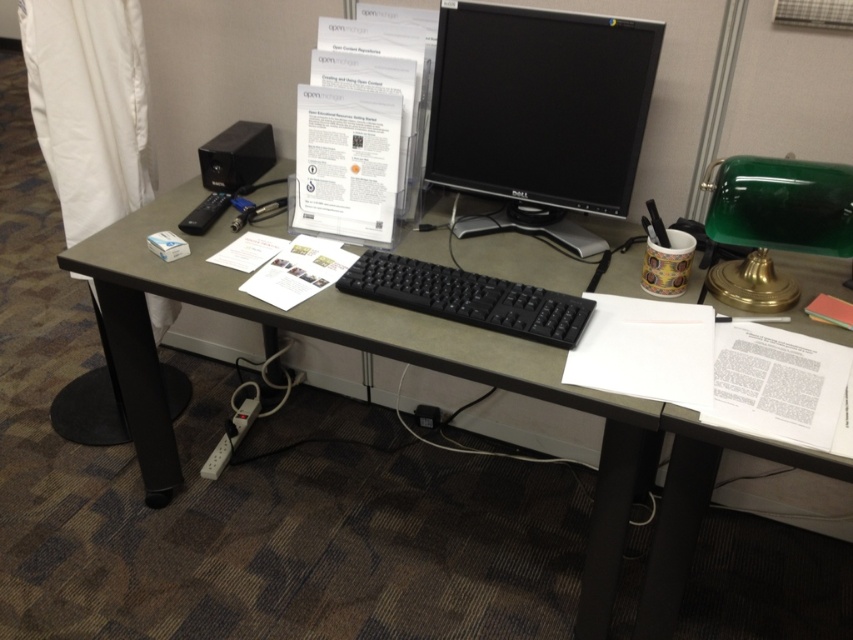
Does black plastic computer desk at center have a larger size compared to black matte keyboard at center?

Yes, black plastic computer desk at center is bigger than black matte keyboard at center.

Can you confirm if black plastic computer desk at center is positioned above black matte keyboard at center?

No.

Is point (579, 276) positioned in front of point (498, 308)?

That is False.

Find the location of a particular element. This screenshot has height=640, width=853. black plastic computer desk at center is located at coordinates (430, 369).

Between black plastic computer desk at center and black glossy monitor at center, which one is positioned lower?

black plastic computer desk at center is lower down.

Is black plastic computer desk at center positioned at the back of black glossy monitor at center?

No.

Locate an element on the screen. The image size is (853, 640). black plastic computer desk at center is located at coordinates (430, 369).

Is point (647, 97) positioned after point (566, 312)?

That is True.

From the picture: Does black glossy monitor at center have a smaller size compared to black matte keyboard at center?

No.

Which is in front, point (519, 122) or point (579, 301)?

Point (579, 301) is in front.

This screenshot has width=853, height=640. What are the coordinates of `black glossy monitor at center` in the screenshot? It's located at (540, 104).